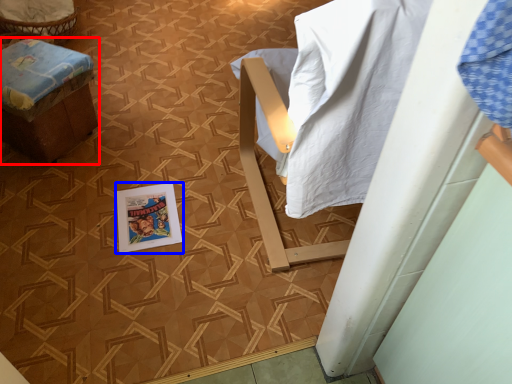
Question: Which object is further to the camera taking this photo, furniture (highlighted by a red box) or comic book (highlighted by a blue box)?

Choices:
 (A) furniture
 (B) comic book

Answer: (B)